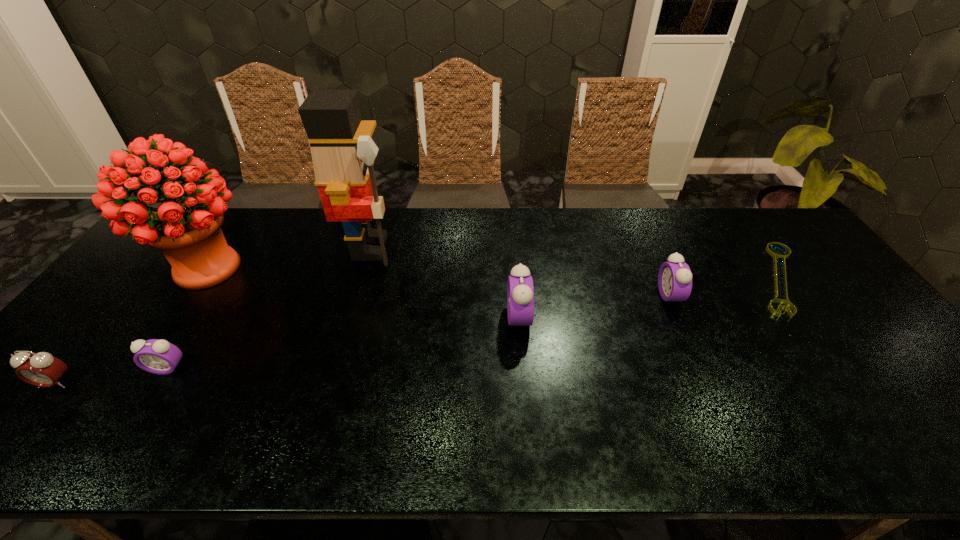
This screenshot has height=540, width=960. I want to click on the nearest object, so click(41, 369).

Where is `vacant region located on the face of the shortest alarm clock`? vacant region located on the face of the shortest alarm clock is located at coordinates (139, 413).

Image resolution: width=960 pixels, height=540 pixels. I want to click on vacant position located on the face of the third tallest object, so click(456, 318).

Identify the location of vacant space located 0.110m on the face of the third tallest object. The width and height of the screenshot is (960, 540). (468, 318).

The height and width of the screenshot is (540, 960). Find the location of `free location located 0.140m on the face of the third tallest object`. free location located 0.140m on the face of the third tallest object is located at coordinates (456, 318).

The image size is (960, 540). What are the coordinates of `free space located 0.260m on the face of the sixth object from left to right` in the screenshot? It's located at pyautogui.click(x=569, y=295).

The height and width of the screenshot is (540, 960). I want to click on vacant region located 0.380m on the face of the sixth object from left to right, so pyautogui.click(x=527, y=295).

The image size is (960, 540). What are the coordinates of `free space located on the face of the sixth object from left to right` in the screenshot? It's located at (587, 295).

Locate an element on the screen. This screenshot has width=960, height=540. vacant space situated in front of the fourth object from left to right holding the staff is located at coordinates (468, 248).

Where is `free space located on the front of the rightmost object`? This screenshot has width=960, height=540. free space located on the front of the rightmost object is located at coordinates (843, 367).